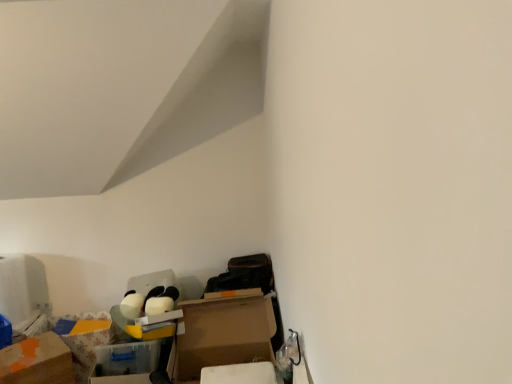
Question: From the image's perspective, is cardboard box at lower left, positioned as the 2th cardboard box in left-to-right order, positioned above or below translucent plastic storage box at lower left, the first storage box from the right?

Choices:
 (A) below
 (B) above

Answer: (B)

Question: In terms of size, does cardboard box at lower left, arranged as the first cardboard box when viewed from the right, appear bigger or smaller than translucent plastic storage box at lower left, the first storage box from the right?

Choices:
 (A) small
 (B) big

Answer: (B)

Question: Which object is the closest to the translucent plastic storage box at lower left, the first storage box from the right?

Choices:
 (A) orange matte cardboard box at lower left, which appears as the second cardboard box when viewed from the right
 (B) cardboard box at lower left, positioned as the 2th cardboard box in left-to-right order
 (C) floral-patterned cardboard box at lower left, which ranks as the 2th storage box in front-to-back order

Answer: (B)

Question: Which object is the farthest from the cardboard box at lower left, positioned as the 2th cardboard box in left-to-right order?

Choices:
 (A) translucent plastic storage box at lower left, which ranks as the 2th storage box in back-to-front order
 (B) orange matte cardboard box at lower left, which appears as the second cardboard box when viewed from the right
 (C) floral-patterned cardboard box at lower left, the 2th storage box viewed from the right

Answer: (B)